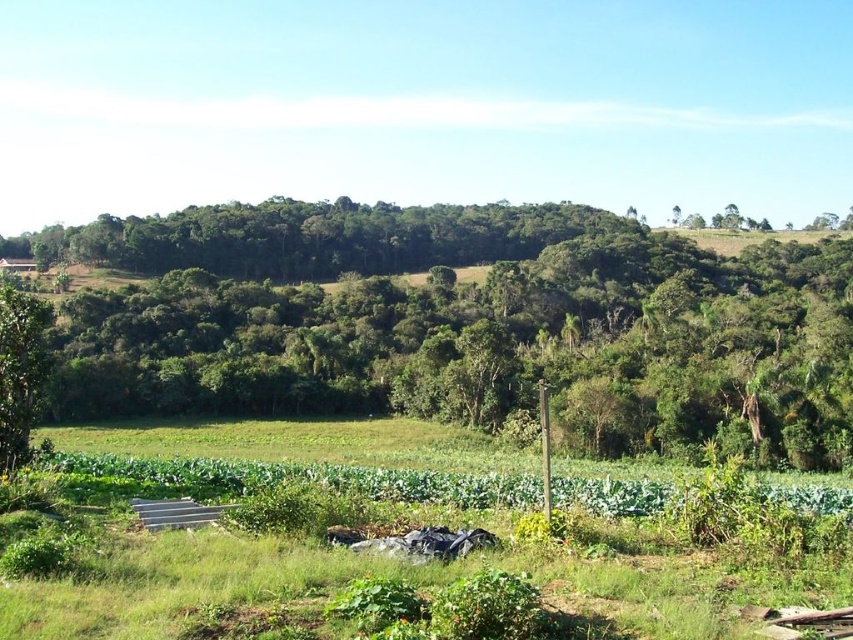
Image resolution: width=853 pixels, height=640 pixels. What do you see at coordinates (467, 324) in the screenshot?
I see `green leafy tree at center` at bounding box center [467, 324].

Looking at this image, who is positioned more to the left, green leafy tree at center or green leafy tree at left?

green leafy tree at center

The width and height of the screenshot is (853, 640). In order to click on green leafy tree at center in this screenshot , I will do `click(467, 324)`.

Where is `green leafy tree at center`? This screenshot has width=853, height=640. green leafy tree at center is located at coordinates (467, 324).